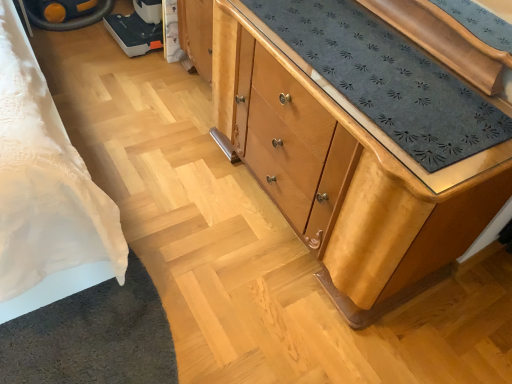
Identify the location of empty space that is in between yellow rubber wheel at upper left and light brown wood chest of drawers at center. The width and height of the screenshot is (512, 384). (153, 109).